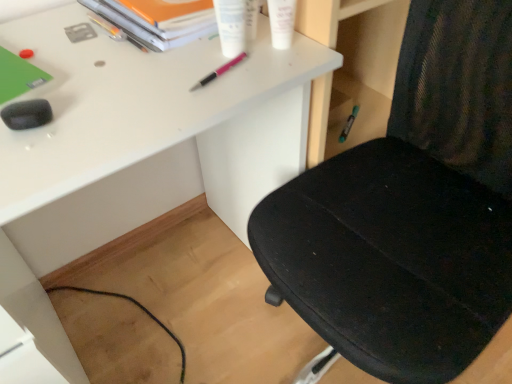
This screenshot has height=384, width=512. What are the coordinates of `unoccupied area in front of white plastic tubes at upper center, positioned as the 4th stationery in left-to-right order` in the screenshot? It's located at (205, 93).